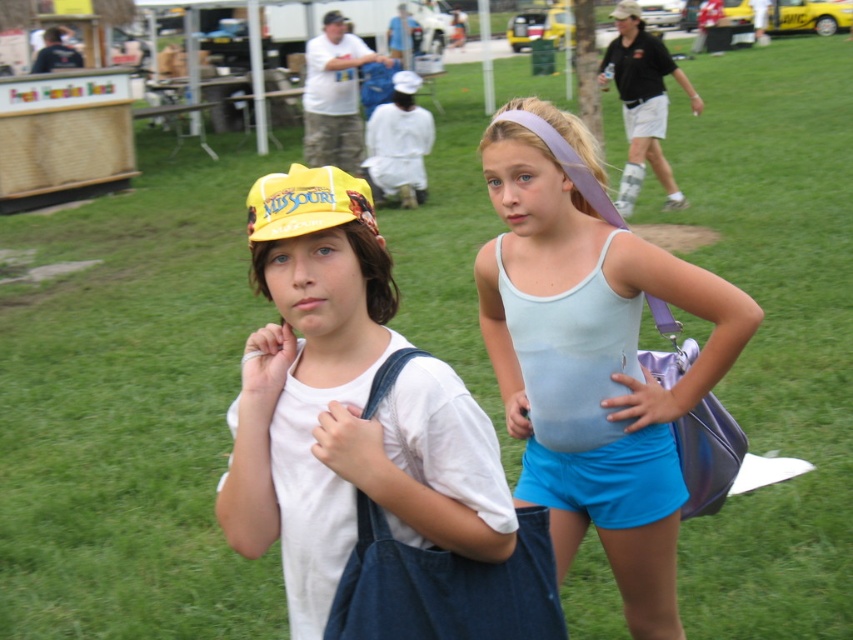
Looking at this image, you are standing at point (299, 204) and want to walk to point (602, 332). Is the destination point behind you relative to your current position?

Yes, the destination point (602, 332) is behind point (299, 204), so it would be behind you if you are currently at point (299, 204).

Looking at this image, you are a photographer trying to capture a clear shot of the white matte shirt at center and the yellow fabric cap at upper center. Based on their sizes, which object should you focus on first to ensure it appears sharp in the photo?

The white matte shirt at center has a smaller size compared to the yellow fabric cap at upper center, so you should focus on the yellow fabric cap at upper center first to ensure it appears sharp in the photo.